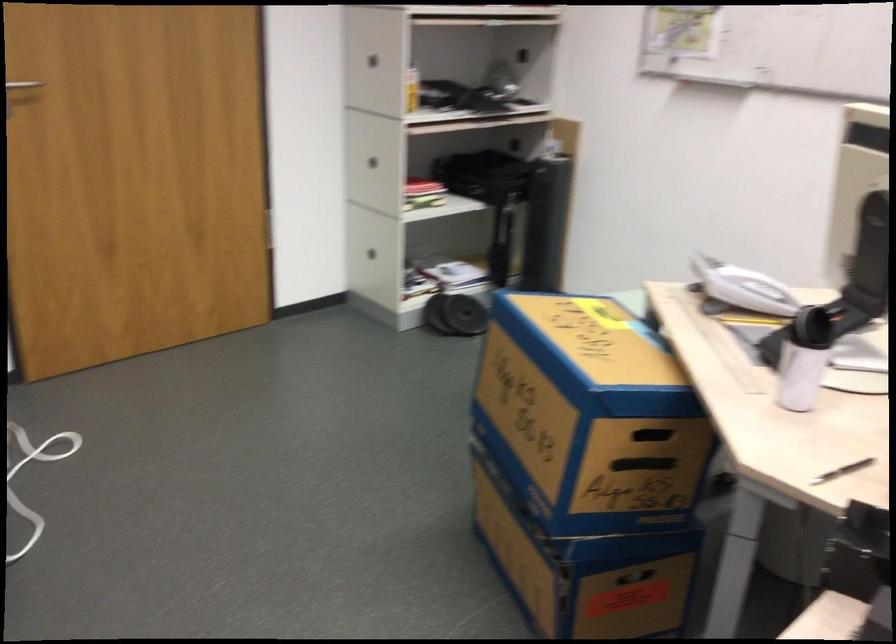
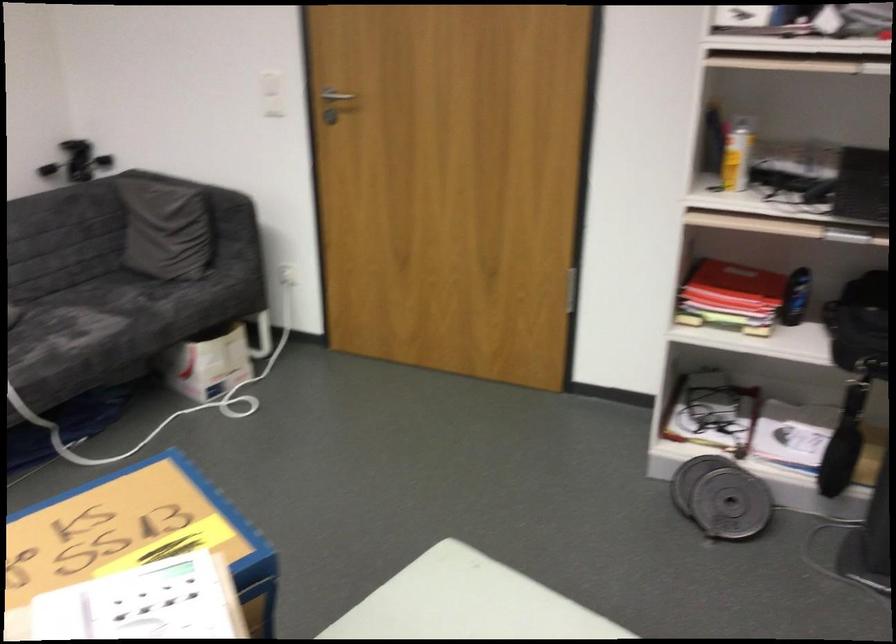
Locate, in the second image, the point that corresponds to the point at 441,180 in the first image.

(796, 297)